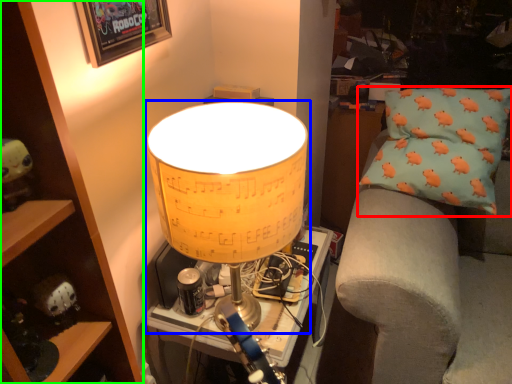
Question: Based on their relative distances, which object is farther from pillow (highlighted by a red box)? Choose from lamp (highlighted by a blue box) and cabinet (highlighted by a green box).

Choices:
 (A) lamp
 (B) cabinet

Answer: (B)